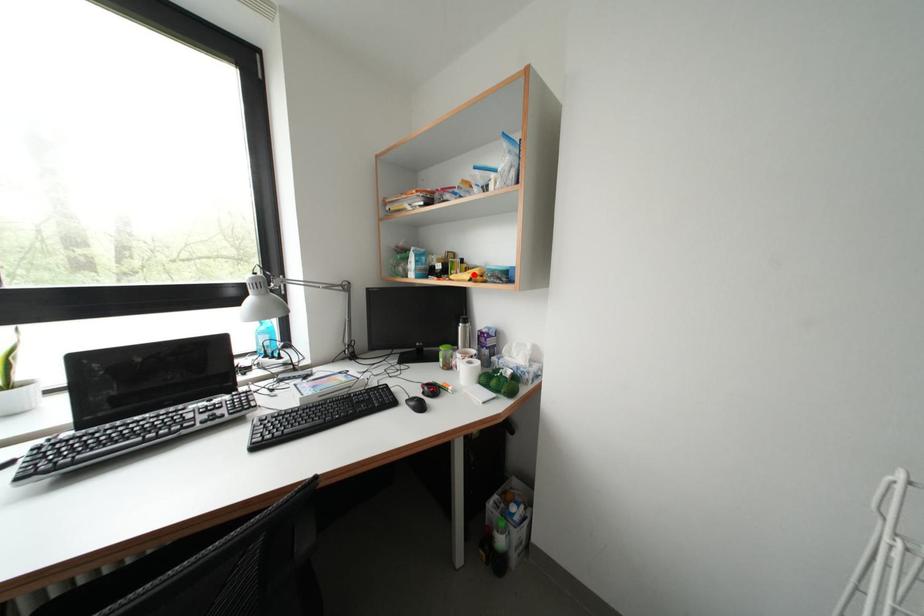
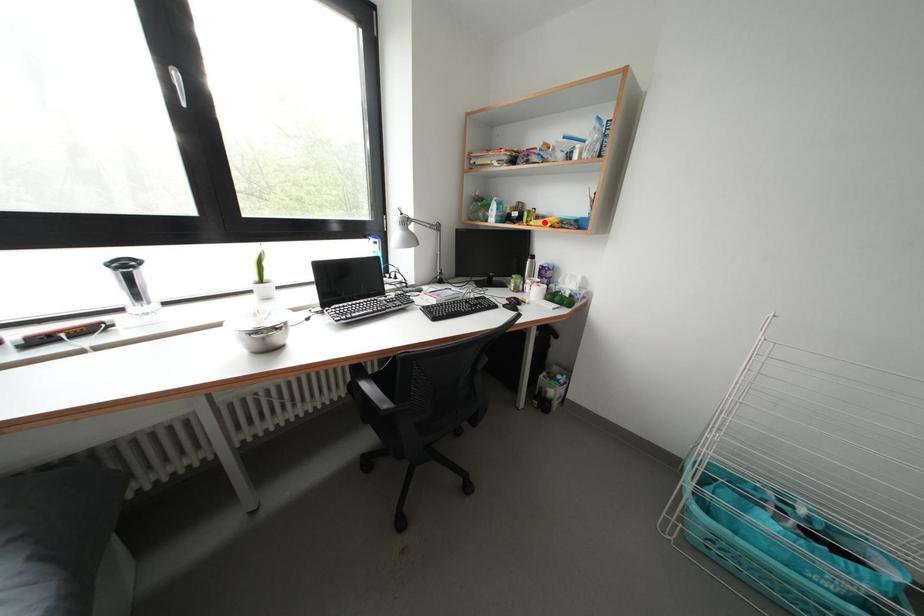
I am providing you with two images of the same scene from different viewpoints. A red point is marked on the first image and another point is marked on the second image. Are the points marked in image1 and image2 representing the same 3D position?

Yes